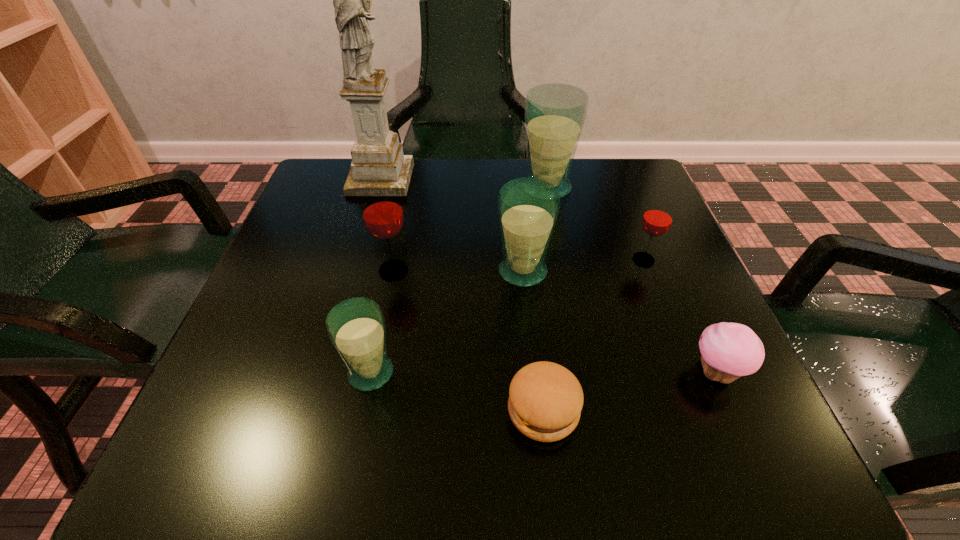
At what (x,y) coordinates should I click in order to perform the action: click on free space located on the back of the cupcake. Please return your answer as a coordinate pair (x, y). Looking at the image, I should click on (684, 301).

Image resolution: width=960 pixels, height=540 pixels. What are the coordinates of `vacant space located 0.100m on the right of the brown hamburger` in the screenshot? It's located at (647, 410).

Locate an element on the screen. sculpture at the far edge is located at coordinates tap(377, 156).

Where is `glass that is at the far edge`? glass that is at the far edge is located at coordinates (555, 113).

This screenshot has height=540, width=960. Find the location of `object that is positioned at the near edge`. object that is positioned at the near edge is located at coordinates (545, 401).

At what (x,y) coordinates should I click in order to perform the action: click on object present at the left edge. Please return your answer as a coordinate pair (x, y). This screenshot has height=540, width=960. Looking at the image, I should click on (377, 156).

I want to click on glass that is at the right edge, so click(657, 219).

The width and height of the screenshot is (960, 540). Find the location of `cupcake that is at the right edge`. cupcake that is at the right edge is located at coordinates (728, 351).

You are a GUI agent. You are given a task and a screenshot of the screen. Output one action in this format:
    pyautogui.click(x=<x>, y=<y>)
    Task: Click on the object situated at the far left corner
    
    Given the screenshot: What is the action you would take?
    pyautogui.click(x=377, y=156)

The width and height of the screenshot is (960, 540). I want to click on vacant space at the far edge of the desktop, so click(x=576, y=163).